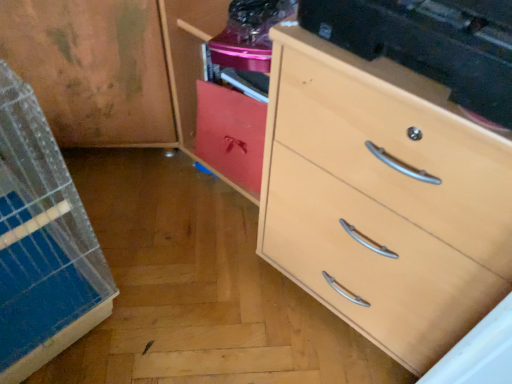
The height and width of the screenshot is (384, 512). What are the coordinates of `free location to the left of light wood chest of drawers at right` in the screenshot? It's located at click(211, 277).